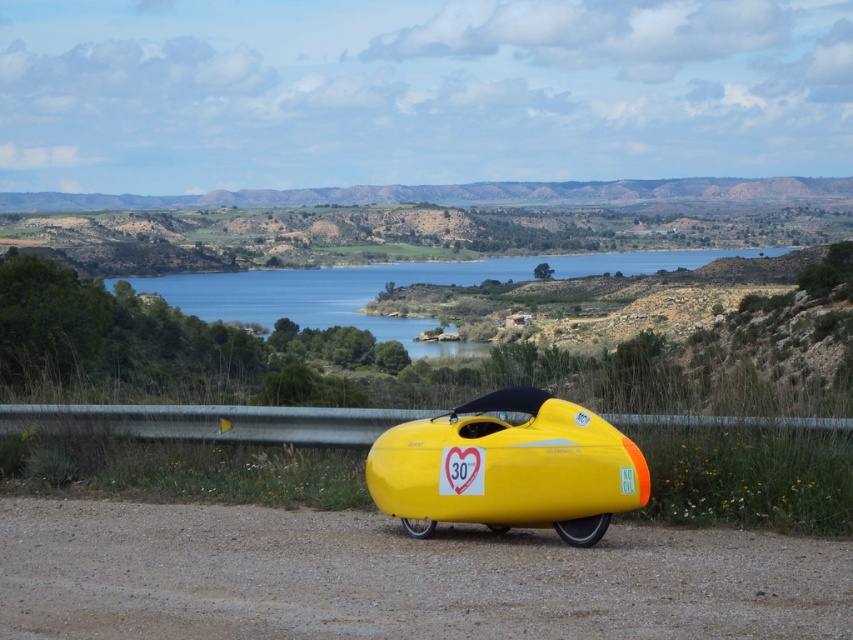
Consider the image. Who is positioned more to the right, yellow matte bicycle at lower center or blue water at center?

Positioned to the right is blue water at center.

Looking at this image, is the position of yellow matte bicycle at lower center more distant than that of blue water at center?

No.

Find the location of `yellow matte bicycle at lower center`. yellow matte bicycle at lower center is located at coordinates (397, 577).

Is point (194, 518) behind point (380, 484)?

Yes, point (194, 518) is behind point (380, 484).

Does point (64, 588) lie in front of point (531, 481)?

Yes, point (64, 588) is closer to viewer.

Identify the location of yellow matte bicycle at lower center. (397, 577).

Is yellow matte bicycle at center positioned in front of blue water at center?

Yes, it is.

Does yellow matte bicycle at center appear on the right side of blue water at center?

No, yellow matte bicycle at center is not to the right of blue water at center.

Between point (397, 448) and point (300, 305), which one is positioned in front?

Point (397, 448)

Image resolution: width=853 pixels, height=640 pixels. I want to click on yellow matte bicycle at center, so click(508, 467).